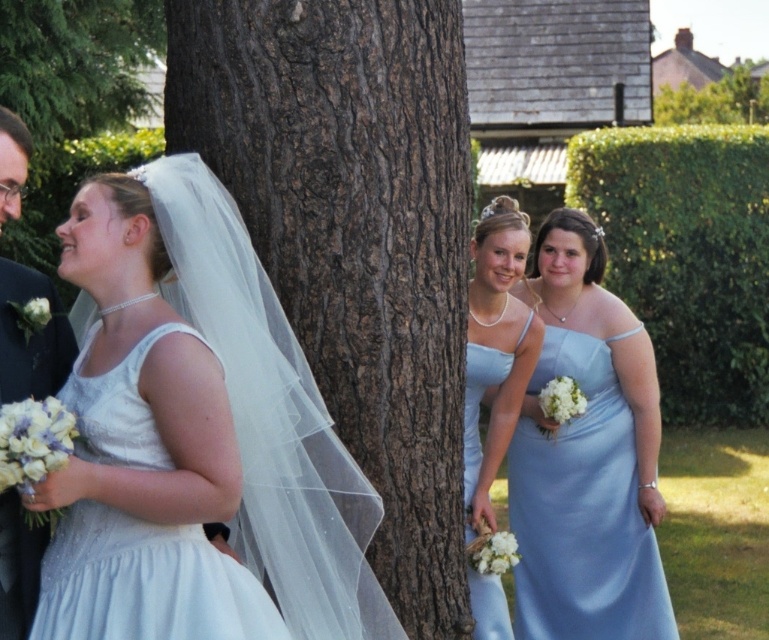
From the picture: Who is more forward, (x=425, y=120) or (x=478, y=470)?

Point (x=425, y=120) is more forward.

Between point (371, 26) and point (524, 326), which one is positioned behind?

Positioned behind is point (524, 326).

Which is behind, point (318, 365) or point (464, 394)?

Positioned behind is point (464, 394).

What are the coordinates of `brown rough bark at center` in the screenshot? It's located at (355, 237).

Is white satin dress at left bigger than light blue satin dress at center?

Actually, white satin dress at left might be smaller than light blue satin dress at center.

Which is behind, point (92, 442) or point (526, 340)?

Point (526, 340)

Between point (252, 596) and point (500, 444), which one is positioned behind?

The point (500, 444) is more distant.

I want to click on white satin dress at left, so click(145, 582).

Between light blue satin dress at center and matte black suit at left, which one is positioned lower?

light blue satin dress at center is lower down.

Is light blue satin dress at center smaller than matte black suit at left?

No.

Is point (500, 220) farther from viewer compared to point (65, 336)?

Yes, it is behind point (65, 336).

Where is `light blue satin dress at center`? This screenshot has width=769, height=640. light blue satin dress at center is located at coordinates (495, 349).